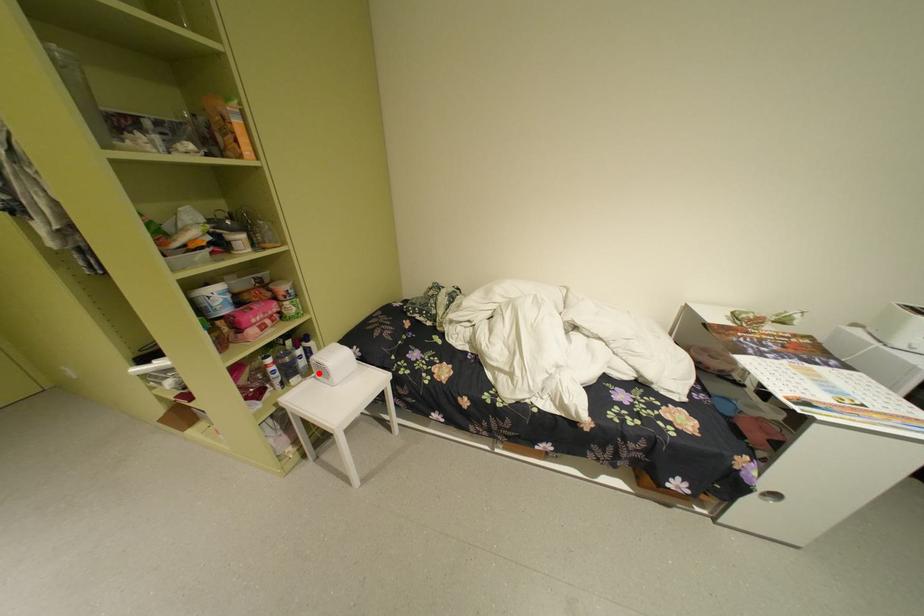
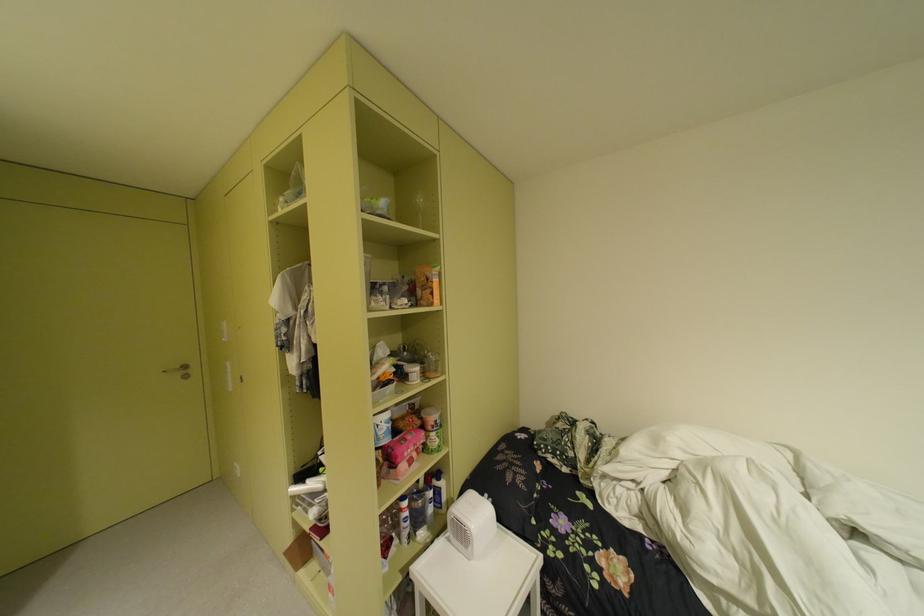
Locate, in the second image, the point that corresponds to the highlighted location in the first image.

(451, 529)